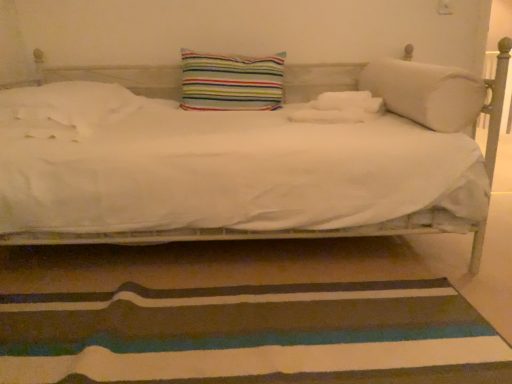
Question: Can you confirm if white soft pillow at left, marked as the 3th pillow in a right-to-left arrangement, is shorter than striped fabric doormat at lower center?

Choices:
 (A) no
 (B) yes

Answer: (A)

Question: Is white soft pillow at left, marked as the 3th pillow in a right-to-left arrangement, at the left side of striped fabric doormat at lower center?

Choices:
 (A) no
 (B) yes

Answer: (B)

Question: From a real-world perspective, is white soft pillow at left, marked as the 3th pillow in a right-to-left arrangement, on striped fabric doormat at lower center?

Choices:
 (A) yes
 (B) no

Answer: (A)

Question: Is white soft pillow at left, marked as the 3th pillow in a right-to-left arrangement, not inside striped fabric doormat at lower center?

Choices:
 (A) yes
 (B) no

Answer: (A)

Question: Considering the relative sizes of white soft pillow at left, the 1th pillow positioned from the left, and striped fabric doormat at lower center in the image provided, is white soft pillow at left, the 1th pillow positioned from the left, taller than striped fabric doormat at lower center?

Choices:
 (A) yes
 (B) no

Answer: (A)

Question: From the image's perspective, is white soft pillow at left, marked as the 3th pillow in a right-to-left arrangement, on striped fabric doormat at lower center?

Choices:
 (A) yes
 (B) no

Answer: (A)

Question: Can you confirm if striped fabric doormat at lower center is positioned to the left of white soft pillow at left, the 1th pillow positioned from the left?

Choices:
 (A) no
 (B) yes

Answer: (A)

Question: Is striped fabric doormat at lower center closer to the viewer compared to white soft pillow at left, marked as the 3th pillow in a right-to-left arrangement?

Choices:
 (A) no
 (B) yes

Answer: (B)

Question: Does striped fabric doormat at lower center have a greater height compared to white soft pillow at left, the 1th pillow positioned from the left?

Choices:
 (A) no
 (B) yes

Answer: (A)

Question: Does striped fabric doormat at lower center have a greater width compared to white soft pillow at left, the 1th pillow positioned from the left?

Choices:
 (A) yes
 (B) no

Answer: (A)

Question: Is striped fabric doormat at lower center facing away from white soft pillow at left, the 1th pillow positioned from the left?

Choices:
 (A) yes
 (B) no

Answer: (B)

Question: From the image's perspective, would you say striped fabric doormat at lower center is shown under white soft pillow at left, marked as the 3th pillow in a right-to-left arrangement?

Choices:
 (A) no
 (B) yes

Answer: (B)

Question: Is striped fabric pillow at center, marked as the 2th pillow in a right-to-left arrangement, in front of white soft cylindrical pillow at right, the first pillow viewed from the right?

Choices:
 (A) no
 (B) yes

Answer: (A)